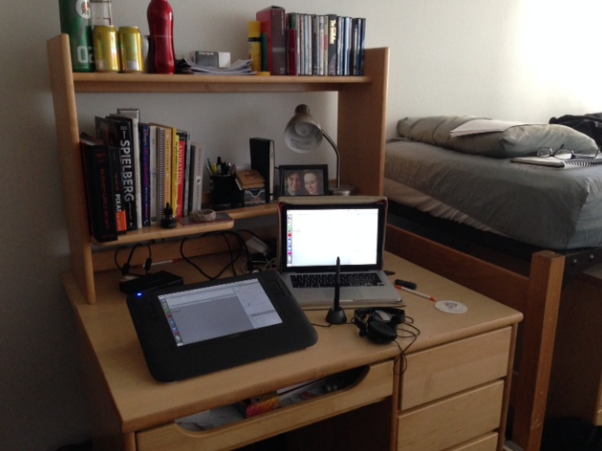
Locate an element on the screen. This screenshot has height=451, width=602. screen is located at coordinates (229, 344).